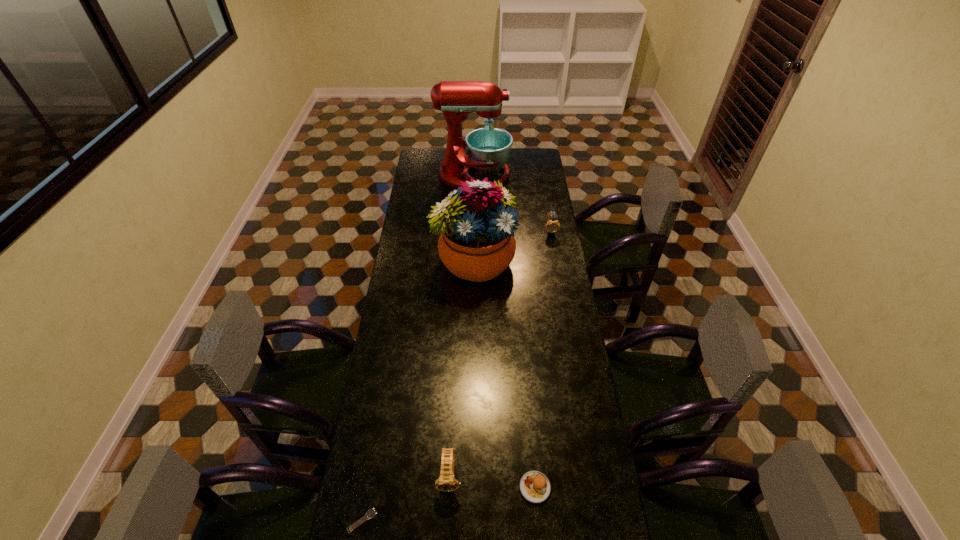
The image size is (960, 540). In order to click on the farthest object in this screenshot , I will do `click(488, 148)`.

Find the location of a particular element. This screenshot has height=540, width=960. mixer is located at coordinates (488, 148).

Where is `the second tallest object`? This screenshot has height=540, width=960. the second tallest object is located at coordinates (477, 243).

Find the location of a particular element. The image size is (960, 540). the farthest watch is located at coordinates click(552, 226).

Find the location of a particular element. This screenshot has width=960, height=540. the rightmost object is located at coordinates (552, 226).

The height and width of the screenshot is (540, 960). I want to click on the second watch from left to right, so click(446, 482).

Identify the location of the fifth tallest object. (535, 487).

Locate an element on the screen. This screenshot has width=960, height=540. the nearest object is located at coordinates (371, 513).

You are a GUI agent. You are given a task and a screenshot of the screen. Output one action in this format:
    pyautogui.click(x=<x>, y=<y>)
    Task: Click on the shortest object
    This screenshot has width=960, height=540.
    Given the screenshot: What is the action you would take?
    pyautogui.click(x=371, y=513)

Identify the location of vacant space located 0.060m on the front-facing side of the farthest object. This screenshot has height=540, width=960. (521, 176).